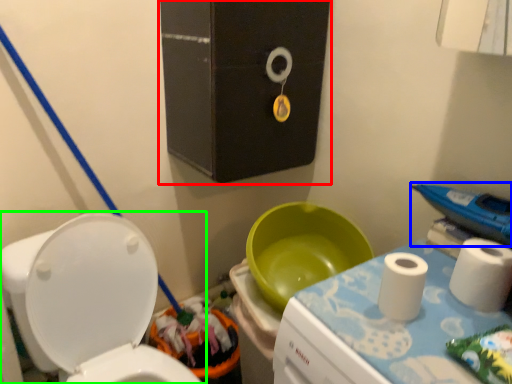
Question: Based on their relative distances, which object is nearer to medicine cabinet (highlighted by a red box)? Choose from appliance (highlighted by a blue box) and toilet (highlighted by a green box).

Choices:
 (A) appliance
 (B) toilet

Answer: (B)